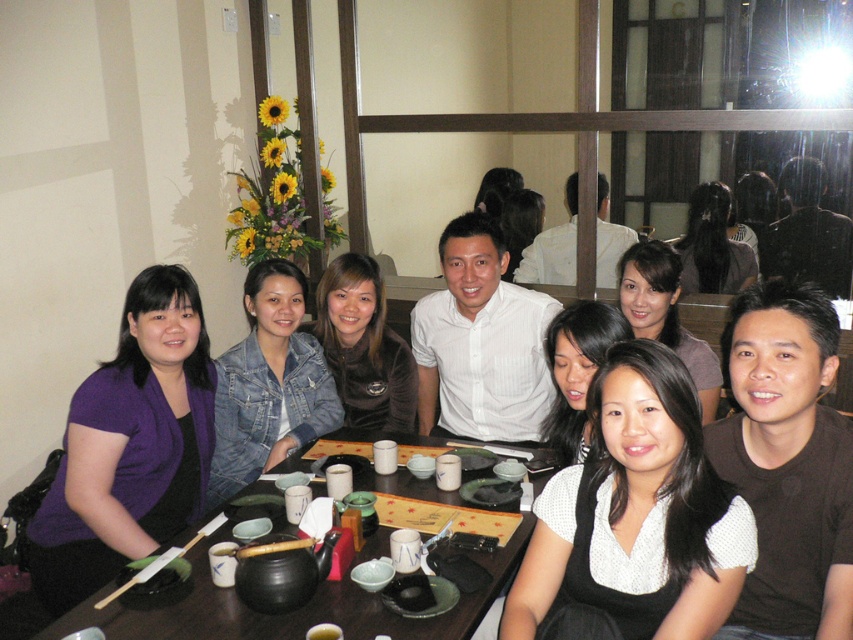
Between black matte hair at center and wooden chopsticks at lower left, which one has less height?

wooden chopsticks at lower left

Is point (561, 340) closer to camera compared to point (113, 595)?

That is False.

Does point (563, 412) come in front of point (120, 589)?

No.

Locate an element on the screen. black matte hair at center is located at coordinates (576, 369).

Between purple fabric shirt at center and smooth brown hair at center, which one appears on the right side from the viewer's perspective?

From the viewer's perspective, smooth brown hair at center appears more on the right side.

Between purple fabric shirt at center and smooth brown hair at center, which one is positioned lower?

purple fabric shirt at center

Which is behind, point (167, 496) or point (651, 257)?

The point (651, 257) is behind.

The image size is (853, 640). Identify the location of purple fabric shirt at center. (129, 445).

Which is more to the left, velvet brown jacket at center or black matte hair at center?

From the viewer's perspective, velvet brown jacket at center appears more on the left side.

Can you confirm if velvet brown jacket at center is positioned to the left of black matte hair at center?

Indeed, velvet brown jacket at center is positioned on the left side of black matte hair at center.

What do you see at coordinates (363, 346) in the screenshot? I see `velvet brown jacket at center` at bounding box center [363, 346].

Identify the location of velvet brown jacket at center. (363, 346).